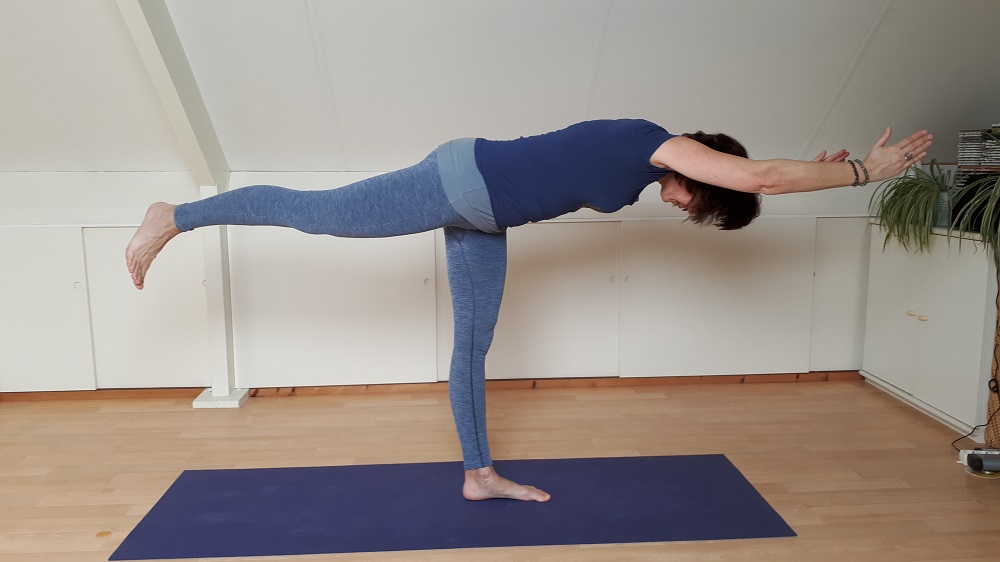
Find the location of a particular element. Image resolution: width=1000 pixels, height=562 pixels. mat is located at coordinates (345, 497).